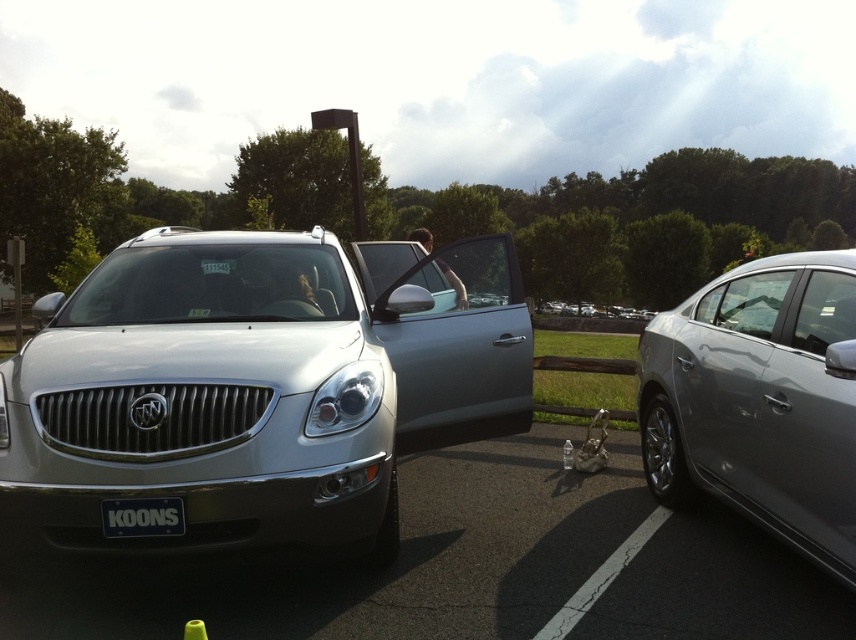
You are a delivery person trying to park your van between the satin silver suv at center and the satin silver sedan at right. Based on their positions, which side of the road should you position your van on to ensure it is between them?

The satin silver suv at center is to the left of the satin silver sedan at right, so you should position your van to the right of the satin silver suv at center and to the left of the satin silver sedan at right to be between them.

Based on the scene description, which object is taller between the satin silver sedan at right and the black matte license plate at center?

The satin silver sedan at right is taller than the black matte license plate at center according to the description.